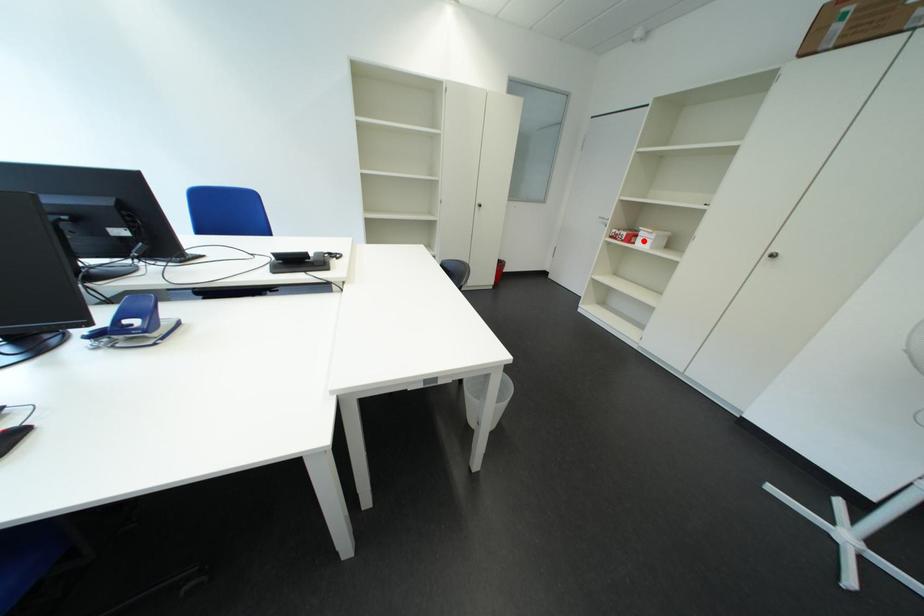
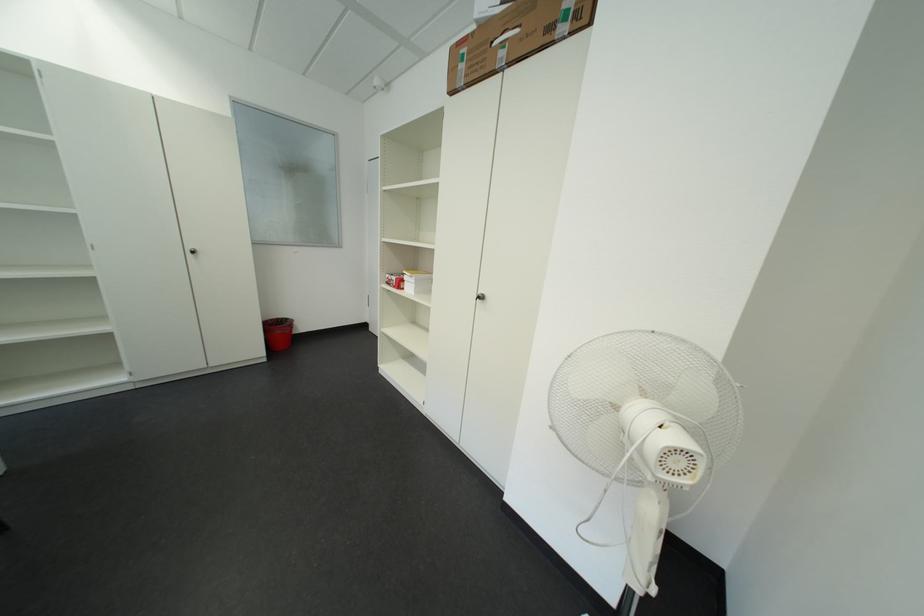
Question: I am providing you with two images of the same scene from different viewpoints. A red point is shown in image1. For the corresponding object point in image2, is it positioned nearer or farther from the camera?

Choices:
 (A) Nearer
 (B) Farther

Answer: (B)